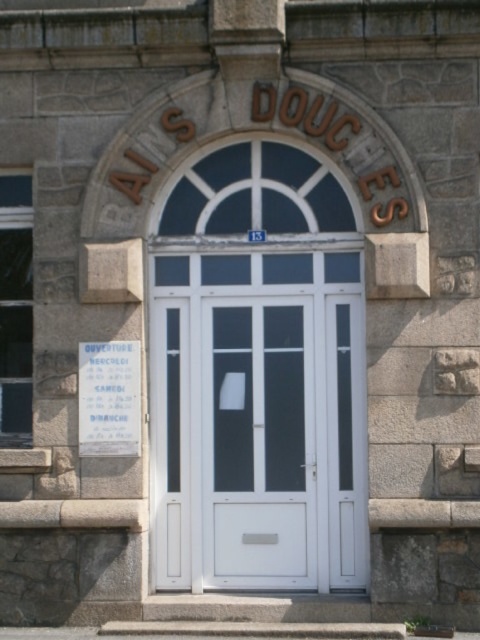
Question: Which of the following is the closest to the observer?

Choices:
 (A) (326, 259)
 (B) (330, 604)

Answer: (B)

Question: Is white glossy door at center in front of white matte door at center?

Choices:
 (A) yes
 (B) no

Answer: (A)

Question: In this image, where is white glossy door at center located relative to white matte door at center?

Choices:
 (A) above
 (B) below

Answer: (A)

Question: Can you confirm if white glossy door at center is positioned above white matte door at center?

Choices:
 (A) no
 (B) yes

Answer: (B)

Question: Among these objects, which one is farthest from the camera?

Choices:
 (A) white glossy door at center
 (B) white matte door at center
 (C) gray stone stairs at lower center

Answer: (B)

Question: Among these points, which one is farthest from the camera?

Choices:
 (A) (139, 627)
 (B) (284, 401)
 (C) (268, 531)

Answer: (B)